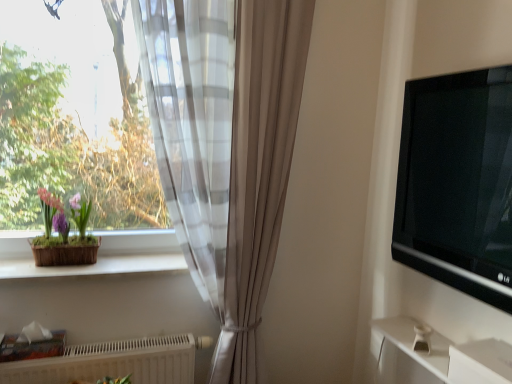
Find the location of a particular element. This screenshot has width=512, height=384. free spot to the right of matte brown pot at left is located at coordinates (112, 266).